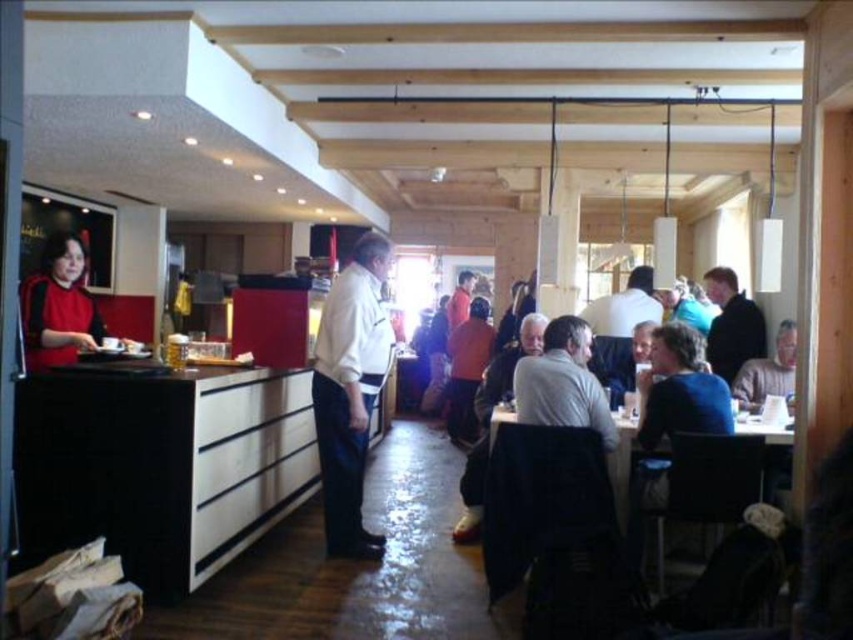
You are a customer in the cafe and want to choose a seat between the matte red sweater at left and the light brown sweater at center. Which one is closer to the counter where the person in the red shirt is working?

The matte red sweater at left is closer to the counter where the person in the red shirt is working because it is positioned to the left of the light brown sweater at center, which is further away from the counter.

You are a photographer taking a group photo of the people in the cozy cafe. You notice two individuals wearing a white smooth shirt at center and a light brown sweater at center. Which clothing item should you focus on if you want to capture the larger one in the photo?

The white smooth shirt at center is larger in size than the light brown sweater at center, so you should focus on the white smooth shirt at center to capture the larger one in the photo.